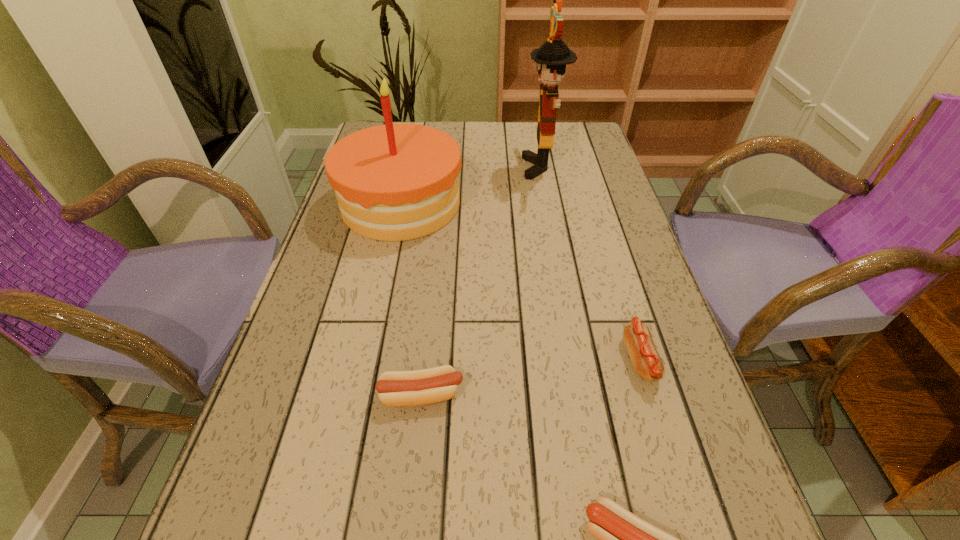
This screenshot has width=960, height=540. What are the coordinates of `the tallest object` in the screenshot? It's located at (551, 58).

At what (x,y) coordinates should I click in order to perform the action: click on the second tallest object. Please return your answer as a coordinate pair (x, y). Image resolution: width=960 pixels, height=540 pixels. Looking at the image, I should click on (394, 182).

Locate an element on the screen. The width and height of the screenshot is (960, 540). the leftmost sausage is located at coordinates (427, 386).

Identify the location of vacant space positioned on the front-facing side of the tallest object. (468, 167).

The width and height of the screenshot is (960, 540). I want to click on free point located 0.260m on the front-facing side of the tallest object, so click(433, 167).

Locate an element on the screen. free spot located on the front-facing side of the tallest object is located at coordinates coord(420,167).

Locate an element on the screen. vacant area situated 0.070m on the back of the fourth shortest object is located at coordinates (411, 158).

Locate an element on the screen. This screenshot has width=960, height=540. free space located on the front of the leftmost sausage is located at coordinates (413, 482).

Locate an element on the screen. The width and height of the screenshot is (960, 540). object that is at the far edge is located at coordinates (551, 58).

This screenshot has width=960, height=540. In order to click on object present at the left edge in this screenshot , I will do `click(394, 182)`.